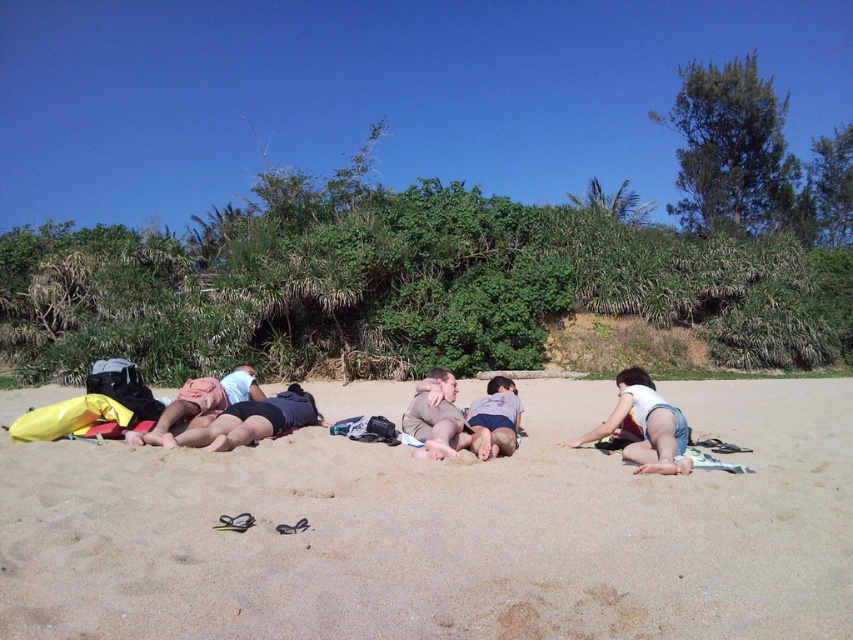
Question: Can you confirm if dark blue shorts at center is positioned below matte pink shorts at center?

Choices:
 (A) no
 (B) yes

Answer: (B)

Question: Is denim shorts at lower right positioned in front of dark blue shorts at center?

Choices:
 (A) no
 (B) yes

Answer: (B)

Question: Does beige sandy beach at center appear on the right side of light gray fabric shorts at center?

Choices:
 (A) yes
 (B) no

Answer: (A)

Question: Which object is the farthest from the light gray fabric shorts at center?

Choices:
 (A) denim shorts at lower right
 (B) beige sandy beach at center
 (C) brown suede jacket at center

Answer: (B)

Question: Which point is farther to the camera?

Choices:
 (A) (183, 518)
 (B) (154, 432)

Answer: (B)

Question: Among these points, which one is farthest from the camera?

Choices:
 (A) (672, 458)
 (B) (207, 387)
 (C) (480, 460)
 (D) (746, 614)

Answer: (B)